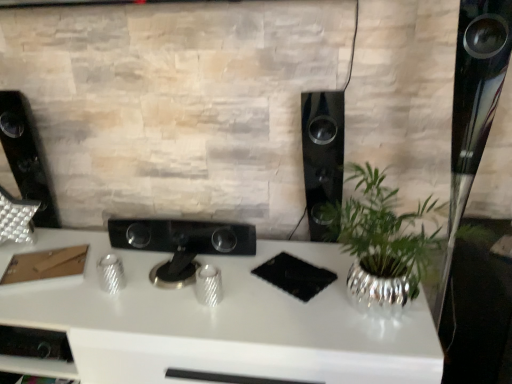
The height and width of the screenshot is (384, 512). I want to click on free space that is to the left of black glossy speaker at center-right, the second speaker positioned from the left, so click(275, 246).